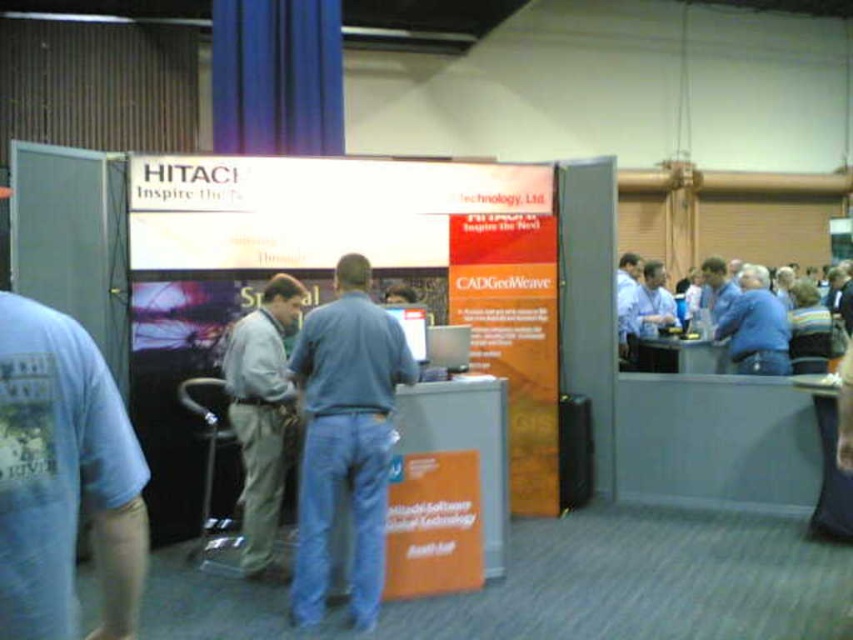
Question: Is blue jeans at center wider than blue shirt at center?

Choices:
 (A) yes
 (B) no

Answer: (B)

Question: Does blue jeans at center appear on the right side of light gray fabric pants at center?

Choices:
 (A) no
 (B) yes

Answer: (B)

Question: Among these objects, which one is nearest to the camera?

Choices:
 (A) light gray fabric pants at center
 (B) blue shirt at center

Answer: (A)

Question: Which object is farther from the camera taking this photo?

Choices:
 (A) blue jeans at center
 (B) light gray fabric pants at center
 (C) blue shirt at center

Answer: (C)

Question: Which object is closer to the camera taking this photo?

Choices:
 (A) blue shirt at center
 (B) light gray fabric pants at center

Answer: (B)

Question: Considering the relative positions of blue jeans at center and light gray fabric pants at center in the image provided, where is blue jeans at center located with respect to light gray fabric pants at center?

Choices:
 (A) left
 (B) right

Answer: (B)